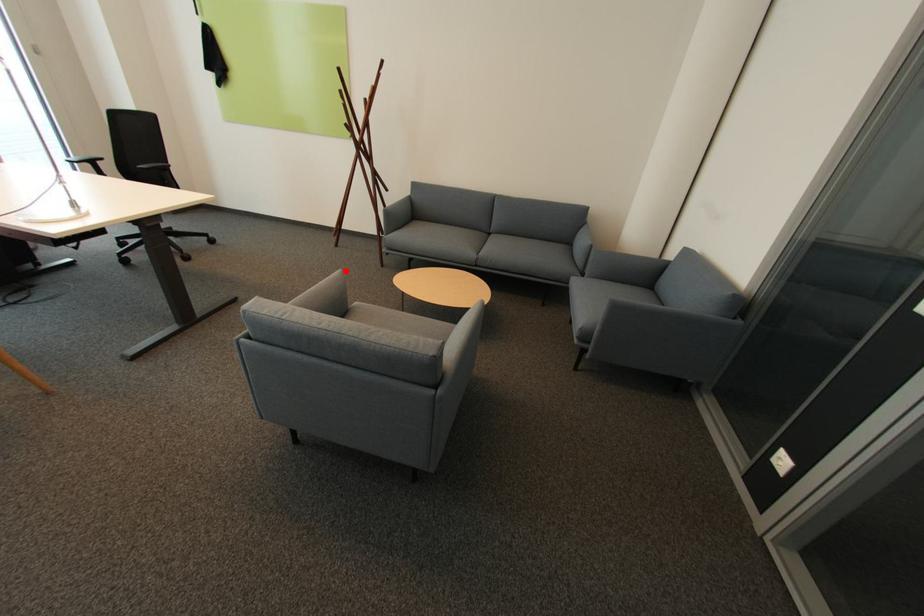
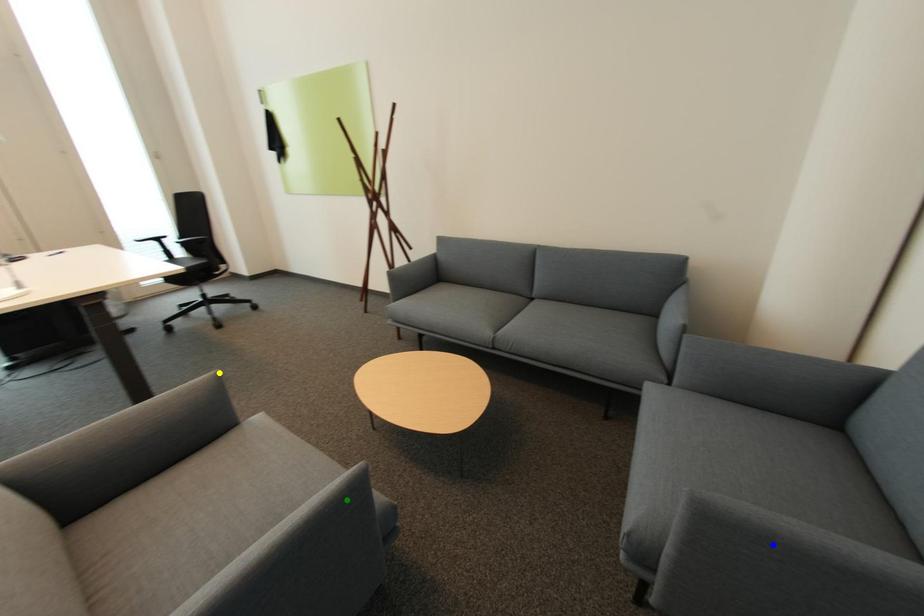
Question: I am providing you with two images of the same scene from different viewpoints. A red point is marked on the first image. You are given multiple points on the second image. Which point in image 2 is actually the same real-world point as the red point in image 1?

Choices:
 (A) green point
 (B) yellow point
 (C) blue point

Answer: (B)